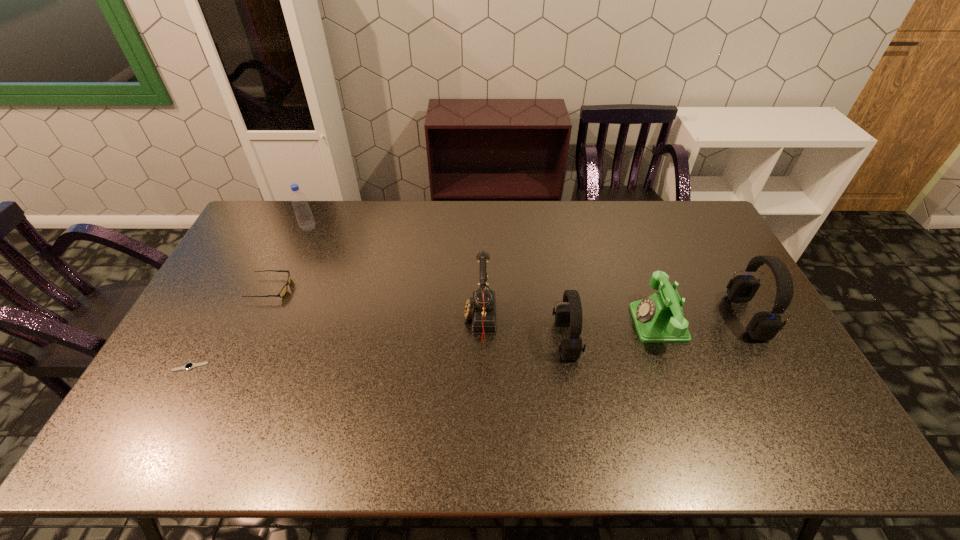
Find the location of `vacant space that's between the sunglasses and the left telephone`. vacant space that's between the sunglasses and the left telephone is located at coordinates (375, 304).

The width and height of the screenshot is (960, 540). What are the coordinates of `vacant point located between the farthest object and the sunglasses` in the screenshot? It's located at (290, 258).

Identify which object is located as the nearest to the sixth object from left to right. Please provide its 2D coordinates. Your answer should be formatted as a tuple, i.e. [(x, y)], where the tuple contains the x and y coordinates of a point satisfying the conditions above.

[(764, 326)]

Point out which object is positioned as the third nearest to the bottle. Please provide its 2D coordinates. Your answer should be formatted as a tuple, i.e. [(x, y)], where the tuple contains the x and y coordinates of a point satisfying the conditions above.

[(481, 307)]